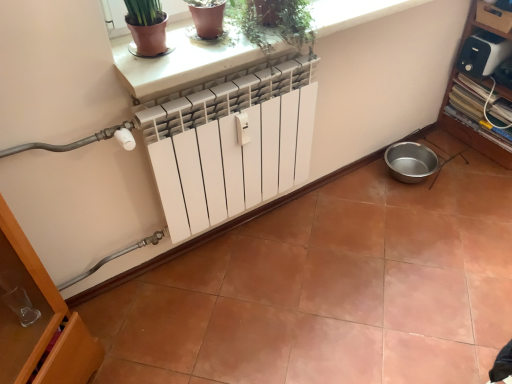
The height and width of the screenshot is (384, 512). Identify the location of free space above white glossy radiator at center (from a real-world perspective). point(326,279).